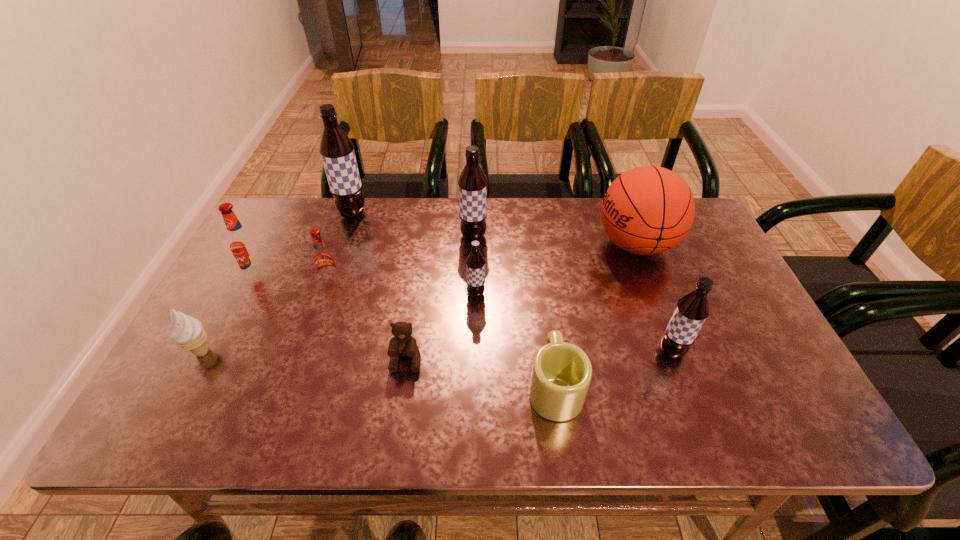
At what (x,y) coordinates should I click in order to perform the action: click on vacant position located on the right of the leftmost root beer. Please return your answer as a coordinate pair (x, y). The height and width of the screenshot is (540, 960). Looking at the image, I should click on (383, 275).

You are a GUI agent. You are given a task and a screenshot of the screen. Output one action in this format:
    pyautogui.click(x=<x>, y=<y>)
    Task: Click on the free space located 0.330m on the back of the rightmost brown root beer
    
    Given the screenshot: What is the action you would take?
    635,251

At what (x,y) coordinates should I click in order to perform the action: click on blank space located on the left of the right red root beer. Please return your answer as a coordinate pair (x, y). This screenshot has height=540, width=960. Looking at the image, I should click on (297, 281).

Find the location of a particular element. vacant space located on the left of the third farthest brown root beer is located at coordinates (352, 294).

The image size is (960, 540). In order to click on vacant area situated on the front-facing side of the icecream in this screenshot , I will do `click(169, 415)`.

Where is `free region located with the handle on the side of the mug`? The height and width of the screenshot is (540, 960). free region located with the handle on the side of the mug is located at coordinates point(537,256).

Where is `vacant space located 0.220m with the handle on the side of the mug`? vacant space located 0.220m with the handle on the side of the mug is located at coordinates (541, 288).

Where is `vacant space located with the handle on the side of the mug`? vacant space located with the handle on the side of the mug is located at coordinates (539, 268).

Where is `vacant space positioned on the face of the teddy bear`? This screenshot has height=540, width=960. vacant space positioned on the face of the teddy bear is located at coordinates (399, 405).

Where is `basketball located at the far edge`? basketball located at the far edge is located at coordinates (647, 210).